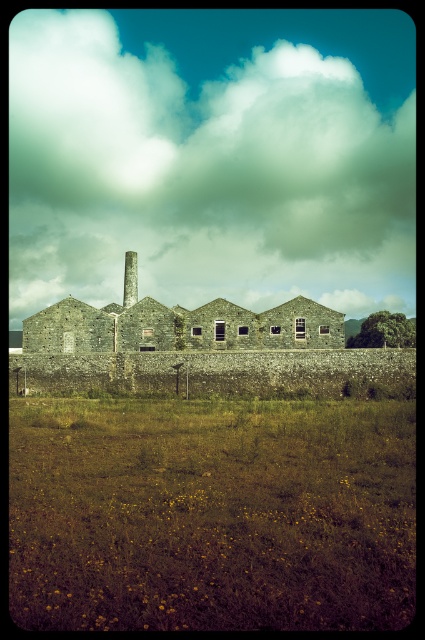
Question: Among these objects, which one is nearest to the camera?

Choices:
 (A) green grass at lower center
 (B) white fluffy cloud at upper center
 (C) stone chimney at center

Answer: (A)

Question: Can you confirm if white fluffy cloud at upper center is smaller than green grass at lower center?

Choices:
 (A) yes
 (B) no

Answer: (B)

Question: Which of the following is the closest to the observer?

Choices:
 (A) (22, 65)
 (B) (136, 272)

Answer: (B)

Question: Is white fluffy cloud at upper center smaller than stone chimney at center?

Choices:
 (A) no
 (B) yes

Answer: (A)

Question: Is white fluffy cloud at upper center positioned before green grass at lower center?

Choices:
 (A) no
 (B) yes

Answer: (A)

Question: Which object is positioned farthest from the green grass at lower center?

Choices:
 (A) stone chimney at center
 (B) white fluffy cloud at upper center

Answer: (B)